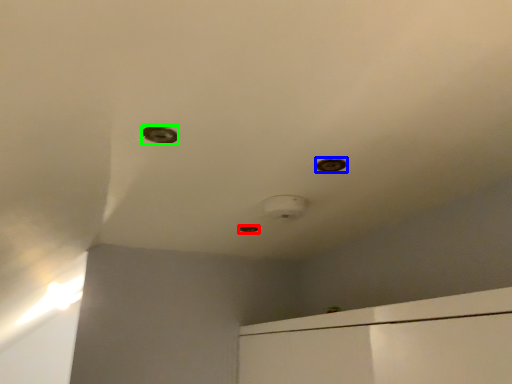
Question: Which object is positioned farthest from hole (highlighted by a red box)? Select from hole (highlighted by a blue box) and hole (highlighted by a green box).

Choices:
 (A) hole
 (B) hole

Answer: (B)